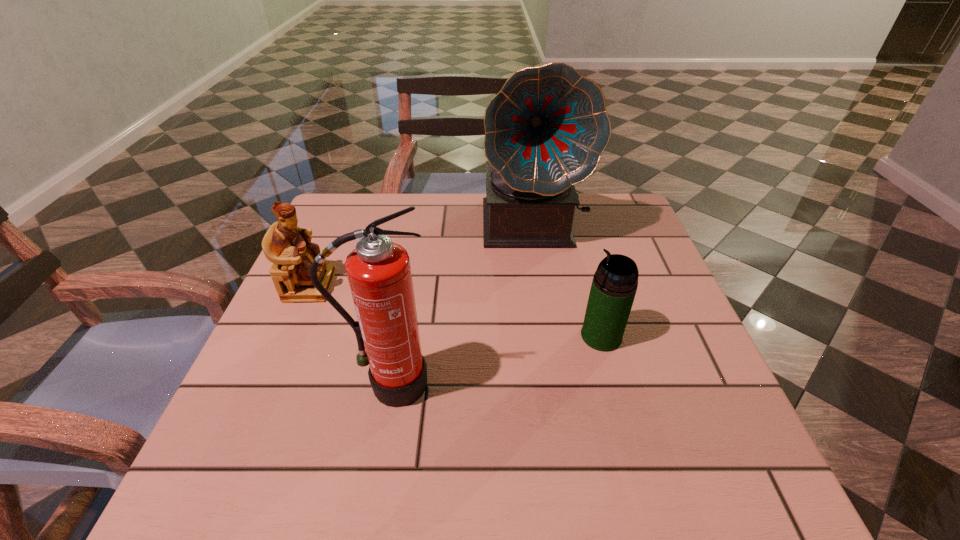
The width and height of the screenshot is (960, 540). I want to click on blank space at the right edge of the desktop, so click(x=639, y=246).

The width and height of the screenshot is (960, 540). In the image, there is a desktop. In order to click on free space at the far left corner in this screenshot , I will do click(375, 215).

The image size is (960, 540). Identify the location of free spot between the third farthest object and the second tallest object. (495, 360).

What are the coordinates of `free spot between the third farthest object and the figurine` in the screenshot? It's located at (455, 311).

Find the location of a particular element. empty space that is in between the record player and the leftmost object is located at coordinates (421, 255).

The height and width of the screenshot is (540, 960). I want to click on blank region between the third farthest object and the fire extinguisher, so click(x=495, y=360).

Identify the location of free area in between the thermos bottle and the leftmost object. This screenshot has height=540, width=960. (455, 311).

You are a GUI agent. You are given a task and a screenshot of the screen. Output one action in this format:
    pyautogui.click(x=<x>, y=<y>)
    Task: Click on the blank region between the farthest object and the fire extinguisher
    The height and width of the screenshot is (540, 960).
    Given the screenshot: What is the action you would take?
    pyautogui.click(x=462, y=304)

Locate an element on the screen. unoccupied position between the record player and the thermos bottle is located at coordinates (567, 280).

Identify the location of vacant point located between the fire extinguisher and the second nearest object. This screenshot has width=960, height=540. (495, 360).